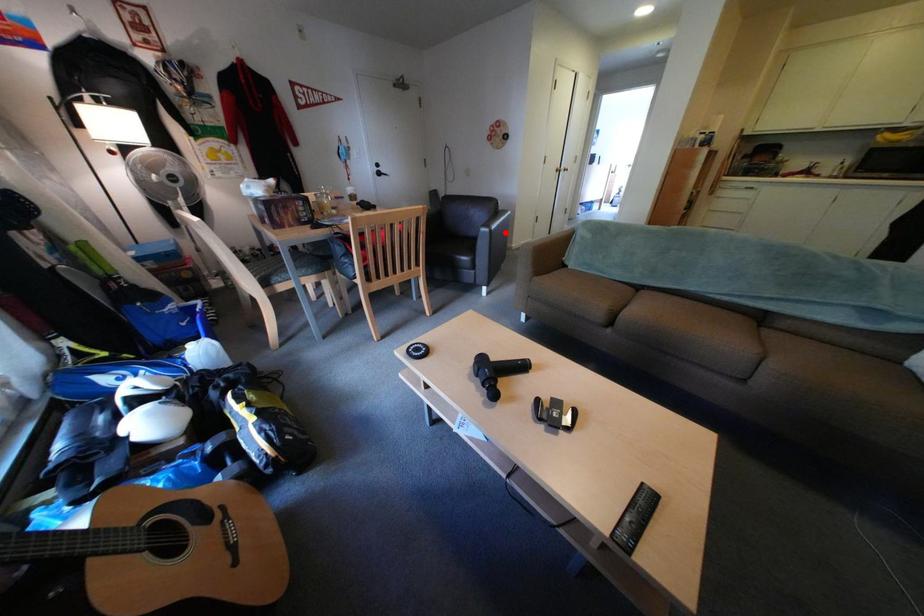
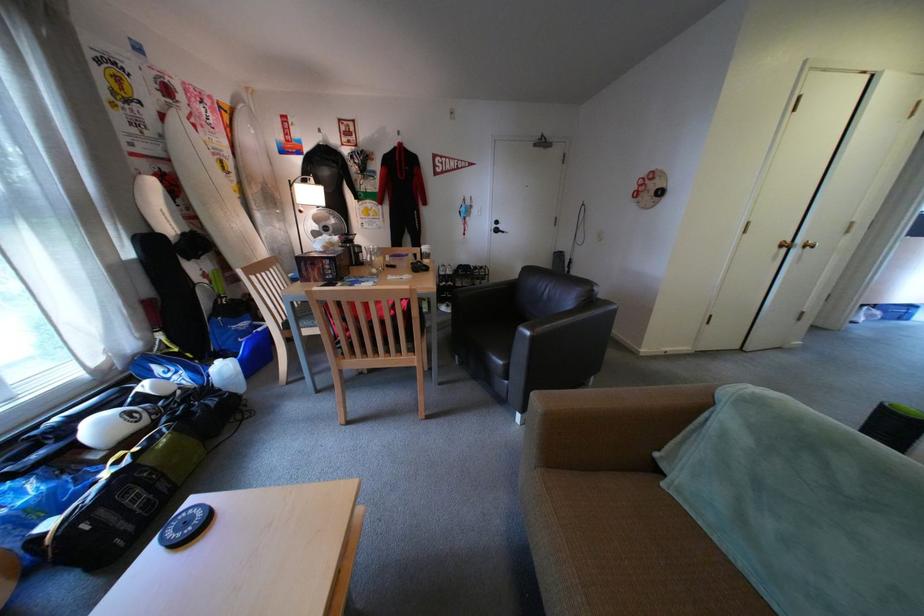
Question: I am providing you with two images of the same scene from different viewpoints. Given a red point in image1, look at the same physical point in image2. Is it:

Choices:
 (A) Closer to the viewpoint
 (B) Farther from the viewpoint

Answer: (B)